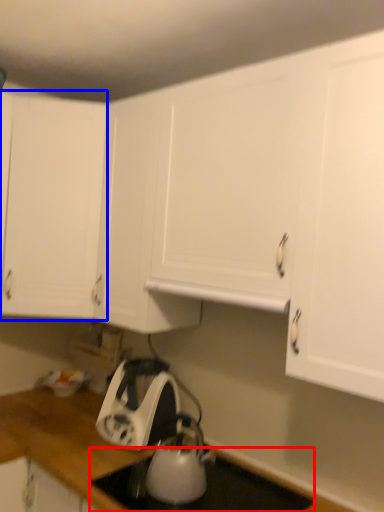
Question: Which object appears closest to the camera in this image, gas stove (highlighted by a red box) or cabinetry (highlighted by a blue box)?

Choices:
 (A) gas stove
 (B) cabinetry

Answer: (A)